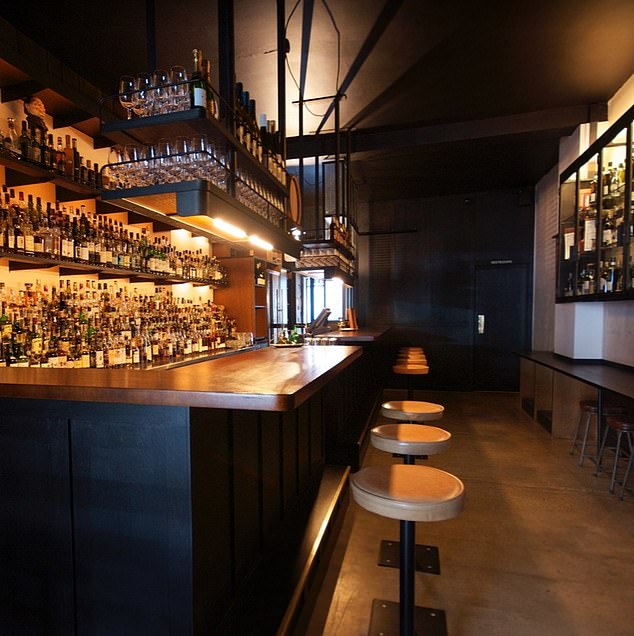
You are a GUI agent. You are given a task and a screenshot of the screen. Output one action in this format:
    pyautogui.click(x=<x>, y=<y>)
    Task: Click on the door handle
    
    Given the screenshot: What is the action you would take?
    (x=480, y=324)